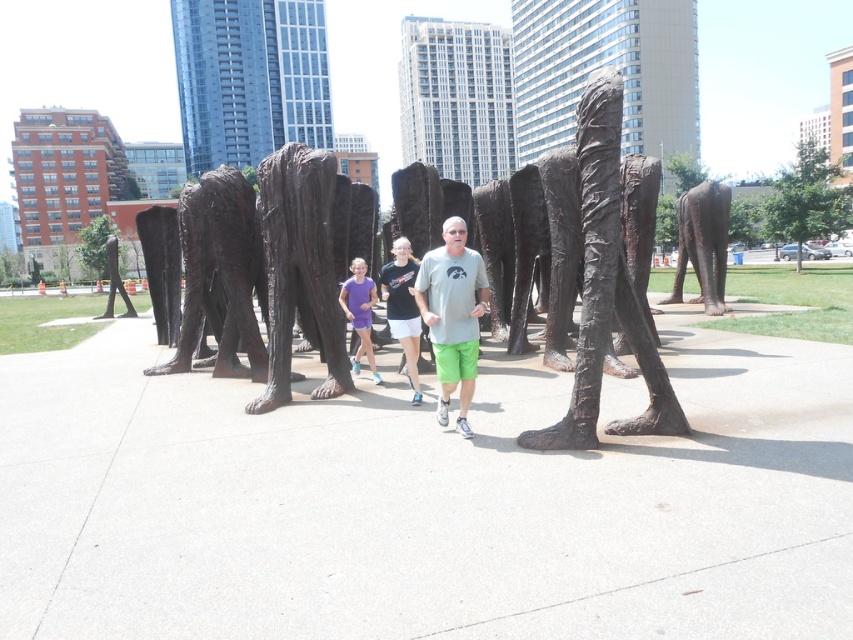
Is point (154, 464) less distant than point (364, 308)?

Yes, it is in front of point (364, 308).

Is smooth concrete pavement at center to the right of matte purple dress at center from the viewer's perspective?

Yes, smooth concrete pavement at center is to the right of matte purple dress at center.

Which is behind, point (96, 337) or point (370, 291)?

Point (96, 337)

I want to click on smooth concrete pavement at center, so click(x=422, y=504).

Between smooth concrete pavement at center and bronze statue at left, which one is positioned higher?

Positioned higher is bronze statue at left.

Who is more distant from viewer, (433, 420) or (111, 236)?

Positioned behind is point (111, 236).

Which is in front, point (22, 600) or point (114, 243)?

Positioned in front is point (22, 600).

You are a GUI agent. You are given a task and a screenshot of the screen. Output one action in this format:
    pyautogui.click(x=<x>, y=<y>)
    Task: Click on the smooth concrete pavement at center
    
    Given the screenshot: What is the action you would take?
    pyautogui.click(x=422, y=504)

Can you confirm if smooth concrete pavement at center is smaller than bronze textured sculpture at center?

Incorrect, smooth concrete pavement at center is not smaller in size than bronze textured sculpture at center.

Based on the photo, measure the distance between smooth concrete pavement at center and camera.

smooth concrete pavement at center is 8.17 feet from camera.

Which is behind, point (695, 372) or point (587, 349)?

The point (695, 372) is more distant.

This screenshot has width=853, height=640. What are the coordinates of `smooth concrete pavement at center` in the screenshot? It's located at (422, 504).